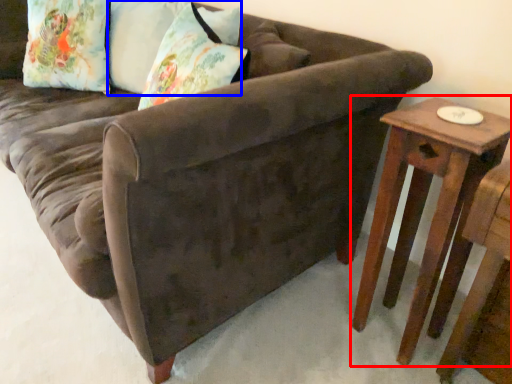
Question: Which object is closer to the camera taking this photo, table (highlighted by a red box) or pillow (highlighted by a blue box)?

Choices:
 (A) table
 (B) pillow

Answer: (A)